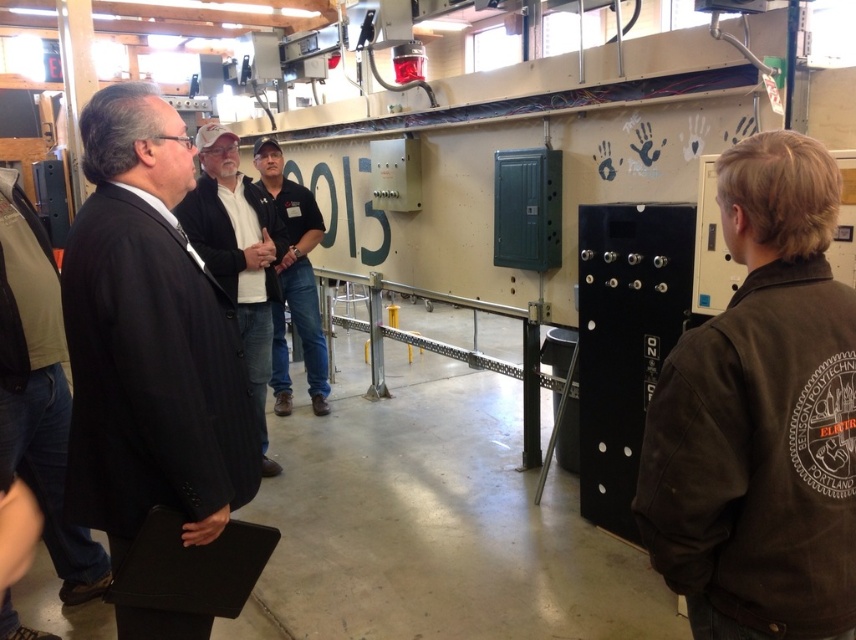
You are an event organizer who needs to arrange a meeting between two important guests. One is wearing a brown corduroy jacket at right and the other is in a dark gray suit at center. To ensure they can converse comfortably, you need to place their chairs so they face each other. Given their current positions, which guest should you move to the left side of the room to facilitate this arrangement?

The brown corduroy jacket at right is to the right of the dark gray suit at center. To face each other, the guest in the brown corduroy jacket at right should move to the left side of the room so they can be positioned opposite the dark gray suit at center.

In the scene, there is a black pinstripe suit at left represented by point (x=149, y=339). Where is this point located in the image?

The point (x=149, y=339) representing the black pinstripe suit at left is located in the lower left quadrant of the image.

You are an event organizer trying to arrange seating for a presentation. You need to decide where to place a chair for the speaker. The brown corduroy jacket at right and the dark gray suit at center are both potential candidates. Which person should you seat in the front row so their head is visible to the audience?

You should seat the brown corduroy jacket at right in the front row because they are shorter than the dark gray suit at center, ensuring their head will be visible over the seat in front.